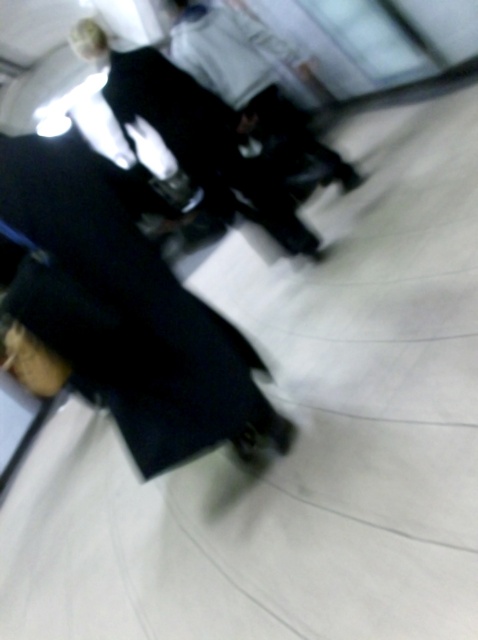
You are a security guard in the lobby and need to distinguish between two jackets in the blurry image. The black leather jacket at upper center and the dark fabric jacket at center. Which one is smaller?

The black leather jacket at upper center is smaller than the dark fabric jacket at center.

You are an interior designer assessing the layout of a lobby. You notice the black fabric business suit at lower left and the black leather jacket at upper center. Which object is taller?

The black fabric business suit at lower left is taller than the black leather jacket at upper center.

You are a delivery robot with a 1.2 meter wide package. You need to navigate through the space between the black fabric business suit at lower left and the camera. Can your package fit through that space?

The distance between the black fabric business suit at lower left and the camera is 1.48 meters. Since your package is 1.2 meters wide, it can fit through the space as it is wider than the package.